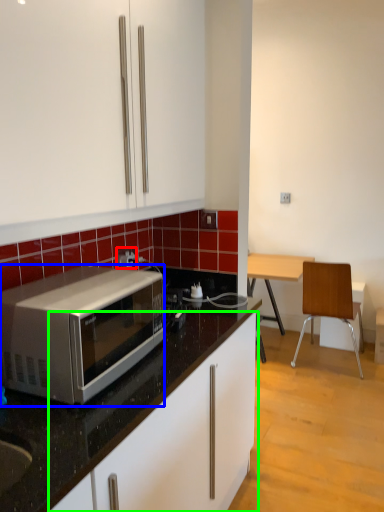
Question: Considering the real-world distances, which object is closest to power outlet (highlighted by a red box)? microwave oven (highlighted by a blue box) or cabinetry (highlighted by a green box).

Choices:
 (A) microwave oven
 (B) cabinetry

Answer: (A)